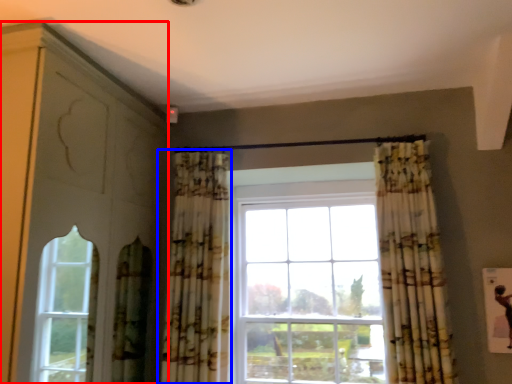
Question: Which object appears farthest to the camera in this image, dresser (highlighted by a red box) or curtain (highlighted by a blue box)?

Choices:
 (A) dresser
 (B) curtain

Answer: (B)